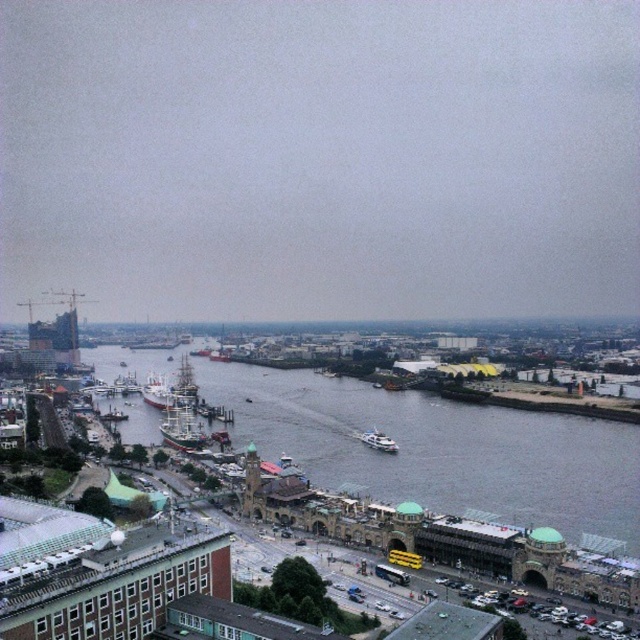
You are a photographer planning to capture a wide shot of the harbor. You want to ensure that both the gray water at center and the white glossy boat at center are clearly visible in your frame. Based on their relative sizes, which object should you prioritize positioning closer to the center of your composition?

The gray water at center is wider than the white glossy boat at center, so positioning the gray water at center closer to the center of the composition would allow it to dominate the frame while still including the white glossy boat at center.

Looking at this image, you are a photographer planning to capture the green wooden ship at center and the gray water at center in a single frame. Based on their positions, which object should you focus on first to ensure both are in the shot?

The green wooden ship at center is to the left of the gray water at center, so focusing on the green wooden ship at center first would allow the photographer to frame both objects effectively.